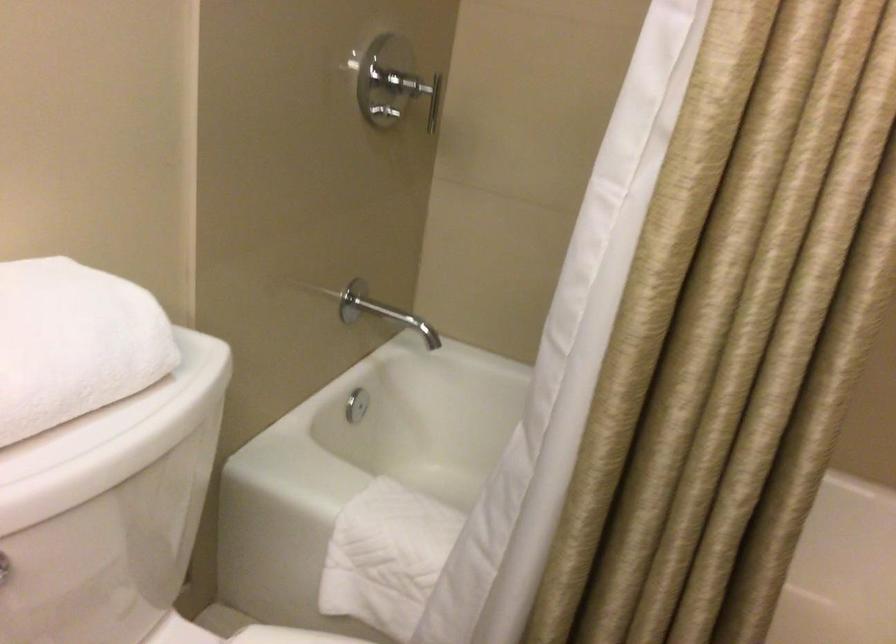
The first image is from the beginning of the video and the second image is from the end. How did the camera likely rotate when shooting the video?

The camera's rotation is toward right-down.